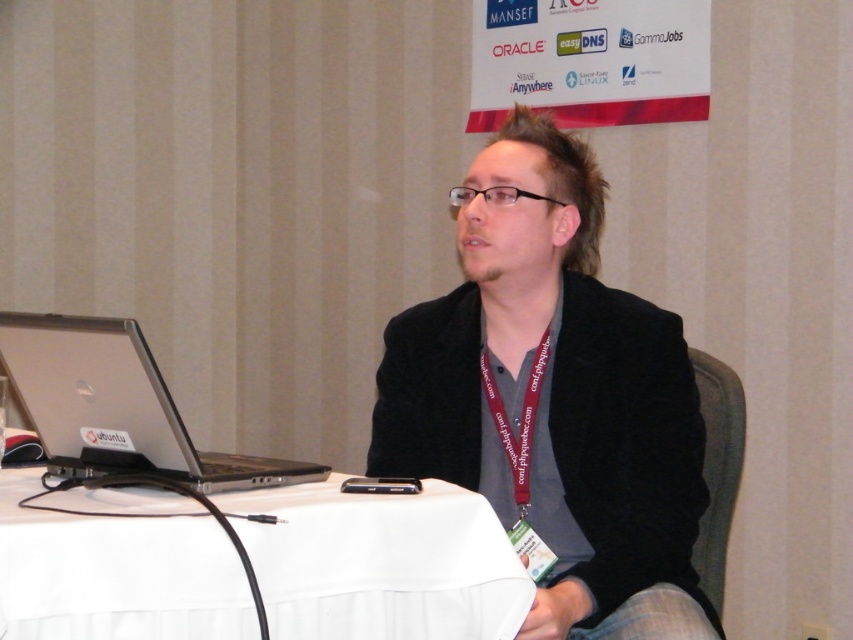
Does gray fabric chair at right appear on the left side of skinny neck at center?

Incorrect, gray fabric chair at right is not on the left side of skinny neck at center.

Does gray fabric chair at right come behind skinny neck at center?

No, it is in front of skinny neck at center.

This screenshot has height=640, width=853. What do you see at coordinates (717, 467) in the screenshot? I see `gray fabric chair at right` at bounding box center [717, 467].

I want to click on gray fabric chair at right, so click(x=717, y=467).

Is white fabric table at lower left positioned at the back of silver metallic laptop at left?

No, white fabric table at lower left is closer to the viewer.

Is white fabric table at lower left to the left of silver metallic laptop at left from the viewer's perspective?

No, white fabric table at lower left is not to the left of silver metallic laptop at left.

You are a GUI agent. You are given a task and a screenshot of the screen. Output one action in this format:
    pyautogui.click(x=<x>, y=<y>)
    Task: Click on the white fabric table at lower left
    The image size is (853, 640).
    Given the screenshot: What is the action you would take?
    pyautogui.click(x=381, y=563)

Between silver metallic laptop at left and burgundy fabric lanyard at center, which one is positioned lower?

burgundy fabric lanyard at center is below.

What do you see at coordinates (115, 406) in the screenshot? I see `silver metallic laptop at left` at bounding box center [115, 406].

Where is `silver metallic laptop at left`? This screenshot has height=640, width=853. silver metallic laptop at left is located at coordinates (115, 406).